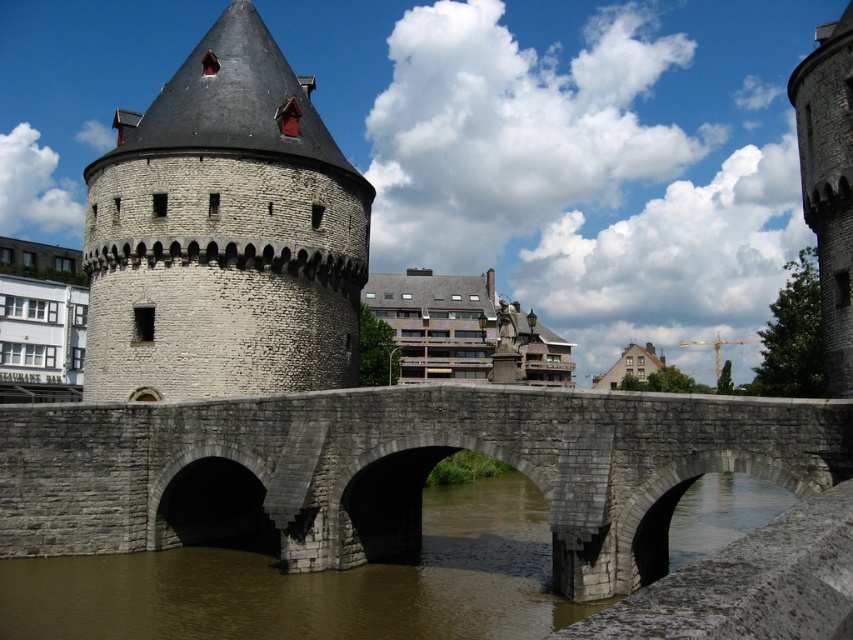
Is gray stone bridge at center thinner than gray stone tower at upper left?

Incorrect, gray stone bridge at center's width is not less than gray stone tower at upper left's.

Can you confirm if gray stone bridge at center is bigger than gray stone tower at upper left?

Yes, gray stone bridge at center is bigger than gray stone tower at upper left.

Which is behind, point (466, 417) or point (186, 333)?

The point (186, 333) is more distant.

Find the location of a particular element. gray stone bridge at center is located at coordinates (393, 470).

Consider the image. Who is more forward, (641, 529) or (819, 97)?

Positioned in front is point (641, 529).

Does gray stone bridge at center have a lesser height compared to gray stone tower at right?

Correct, gray stone bridge at center is not as tall as gray stone tower at right.

Measure the distance between gray stone bridge at center and camera.

gray stone bridge at center is 32.87 meters from camera.

Locate an element on the screen. The height and width of the screenshot is (640, 853). gray stone bridge at center is located at coordinates (393, 470).

Does gray stone tower at upper left appear under gray stone tower at right?

Yes.

Who is lower down, gray stone tower at upper left or gray stone tower at right?

gray stone tower at upper left is lower down.

Does point (225, 211) come farther from viewer compared to point (819, 65)?

Yes, it is behind point (819, 65).

Where is `gray stone tower at upper left`? The height and width of the screenshot is (640, 853). gray stone tower at upper left is located at coordinates (224, 234).